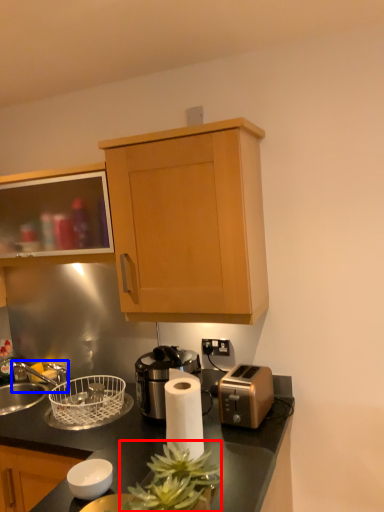
Question: Which of the following is the closest to the observer, plant (highlighted by a red box) or faucet (highlighted by a blue box)?

Choices:
 (A) plant
 (B) faucet

Answer: (A)